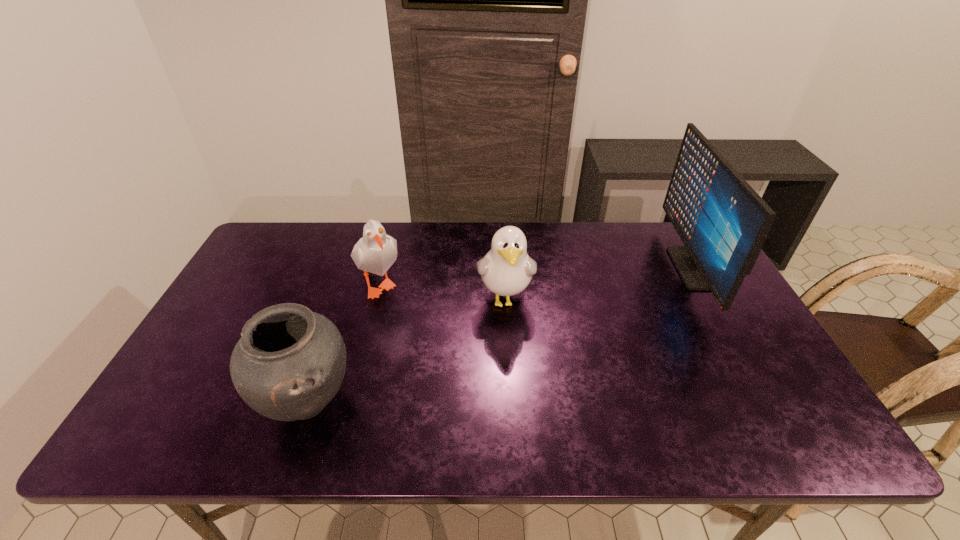
Identify the location of the rightmost object. (722, 221).

Identify the location of the tallest object. Image resolution: width=960 pixels, height=540 pixels. (722, 221).

This screenshot has height=540, width=960. In order to click on the left gull in this screenshot , I will do `click(375, 252)`.

This screenshot has height=540, width=960. Identify the location of the right gull. [x=506, y=270].

Where is `urn`? urn is located at coordinates (290, 362).

The height and width of the screenshot is (540, 960). In order to click on free space located on the screen side of the tallest object in this screenshot , I will do `click(603, 268)`.

Identify the location of free space located on the screen side of the tallest object. Image resolution: width=960 pixels, height=540 pixels. (632, 268).

Identify the location of free space located 0.210m on the screen side of the tallest object. (610, 268).

Locate an element on the screen. The height and width of the screenshot is (540, 960). free space located 0.300m at the beak of the left gull is located at coordinates (346, 414).

You are a GUI agent. You are given a task and a screenshot of the screen. Output one action in this format:
    pyautogui.click(x=<x>, y=<y>)
    Task: Click on the vacant area located on the beak of the right gull
    The height and width of the screenshot is (540, 960).
    Given the screenshot: What is the action you would take?
    pyautogui.click(x=511, y=395)